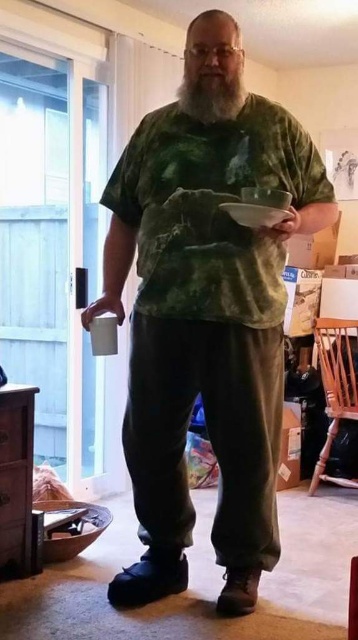
Does point (273, 225) lie behind point (119, 307)?

No, it is not.

Is matte green plate at upper center to the left of matte white cup at lower left from the viewer's perspective?

In fact, matte green plate at upper center is to the right of matte white cup at lower left.

Does point (233, 209) lie behind point (121, 308)?

No, it is not.

This screenshot has width=358, height=640. I want to click on matte green plate at upper center, so click(255, 212).

This screenshot has height=640, width=358. Describe the element at coordinates (205, 332) in the screenshot. I see `matte green tie-dye shirt at center` at that location.

Who is higher up, matte green tie-dye shirt at center or matte green plate at center?

matte green plate at center is above.

This screenshot has height=640, width=358. Describe the element at coordinates (205, 332) in the screenshot. I see `matte green tie-dye shirt at center` at that location.

The height and width of the screenshot is (640, 358). I want to click on matte green tie-dye shirt at center, so click(205, 332).

Between brown wood dresser at lower left and white soft beard at center, which one appears on the left side from the viewer's perspective?

brown wood dresser at lower left is more to the left.

Between point (7, 576) and point (226, 77), which one is positioned in front?

Point (226, 77) is in front.

In order to click on brown wood dresser at lower left in this screenshot , I will do `click(16, 477)`.